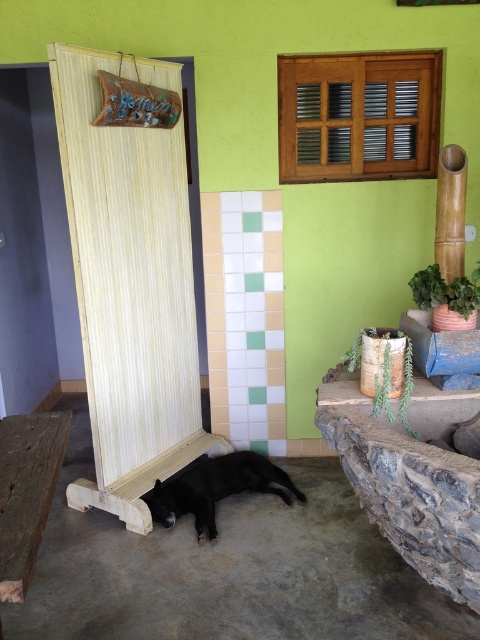
Question: Observing the image, what is the correct spatial positioning of wooden screen at left in reference to black matte dog at lower center?

Choices:
 (A) left
 (B) right

Answer: (A)

Question: Is wooden screen at left behind rustic wooden bench at lower left?

Choices:
 (A) yes
 (B) no

Answer: (A)

Question: Is rustic wooden bench at lower left wider than black matte dog at lower center?

Choices:
 (A) yes
 (B) no

Answer: (B)

Question: Which point appears farthest from the camera in this image?

Choices:
 (A) (154, 499)
 (B) (88, 330)

Answer: (A)

Question: Which point is closer to the camera?

Choices:
 (A) (285, 474)
 (B) (38, 417)

Answer: (B)

Question: Based on their relative distances, which object is farther from the black matte dog at lower center?

Choices:
 (A) rustic wooden bench at lower left
 (B) wooden screen at left

Answer: (A)